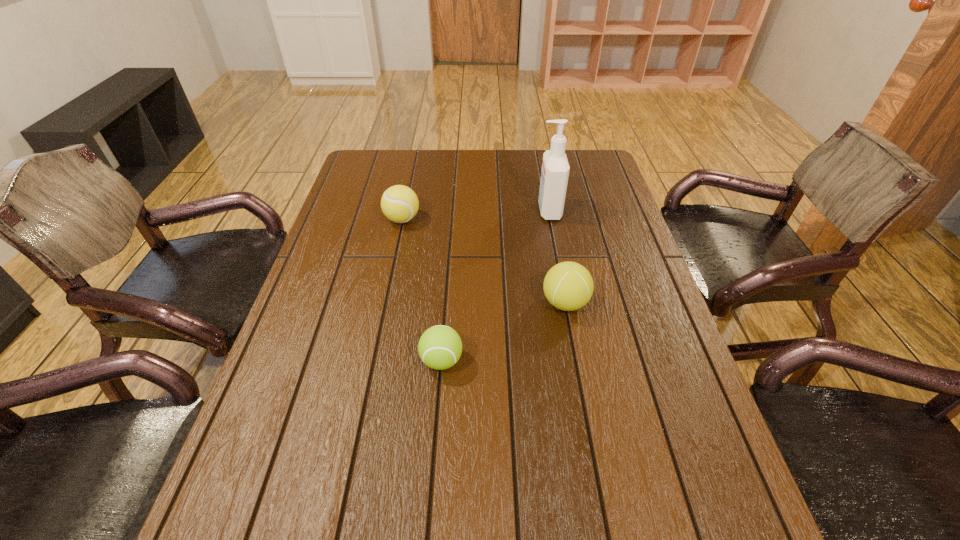
I want to click on cleansing agent, so click(x=555, y=168).

The image size is (960, 540). Find the location of `the second farthest tennis ball`. the second farthest tennis ball is located at coordinates (568, 286).

At what (x,y) coordinates should I click in order to perform the action: click on the second nearest object. Please return your answer as a coordinate pair (x, y). Image resolution: width=960 pixels, height=540 pixels. Looking at the image, I should click on (568, 286).

At what (x,y) coordinates should I click in order to perform the action: click on the leftmost object. Please return your answer as a coordinate pair (x, y). The height and width of the screenshot is (540, 960). Looking at the image, I should click on (399, 203).

This screenshot has height=540, width=960. I want to click on the farthest tennis ball, so click(x=399, y=203).

Find the location of a particular element. Image resolution: width=960 pixels, height=540 pixels. the third object from right to left is located at coordinates (440, 347).

Find the location of a particular element. This screenshot has height=540, width=960. the nearest tennis ball is located at coordinates (440, 347).

This screenshot has height=540, width=960. In order to click on vacant region located on the front label of the cleansing agent in this screenshot , I will do `click(433, 211)`.

Identify the location of vacant space situated 0.230m on the front label of the cleansing agent. Image resolution: width=960 pixels, height=540 pixels. (464, 211).

I want to click on free region located on the front label of the cleansing agent, so click(x=490, y=211).